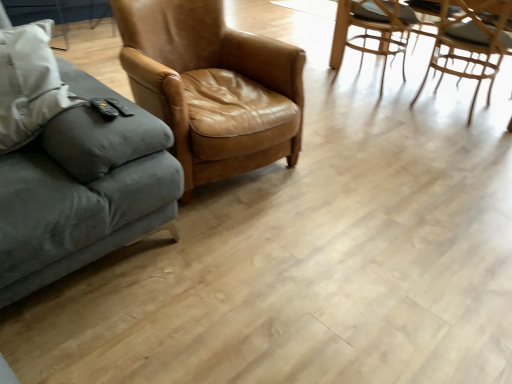
Question: From a real-world perspective, is velvet gray couch at left positioned under light brown woven chair at upper right, positioned as the 2th chair in left-to-right order, based on gravity?

Choices:
 (A) yes
 (B) no

Answer: (B)

Question: From the image's perspective, is velvet gray couch at left located above light brown woven chair at upper right, positioned as the 2th chair in left-to-right order?

Choices:
 (A) yes
 (B) no

Answer: (B)

Question: Can you confirm if velvet gray couch at left is wider than light brown woven chair at upper right, the 2th chair viewed from the right?

Choices:
 (A) no
 (B) yes

Answer: (B)

Question: Considering the relative sizes of velvet gray couch at left and light brown woven chair at upper right, positioned as the 2th chair in left-to-right order, in the image provided, is velvet gray couch at left taller than light brown woven chair at upper right, positioned as the 2th chair in left-to-right order,?

Choices:
 (A) yes
 (B) no

Answer: (A)

Question: Is velvet gray couch at left beside light brown woven chair at upper right, the 2th chair viewed from the right?

Choices:
 (A) yes
 (B) no

Answer: (B)

Question: Is point 473,54 positioned closer to the camera than point 275,122?

Choices:
 (A) farther
 (B) closer

Answer: (A)

Question: In terms of width, does light brown woven chair at upper right, which is counted as the first chair, starting from the right, look wider or thinner when compared to brown leather chair at center, the 1th chair positioned from the left?

Choices:
 (A) thin
 (B) wide

Answer: (A)

Question: From the image's perspective, is light brown woven chair at upper right, the third chair positioned from the left, located above or below brown leather chair at center, the 1th chair positioned from the left?

Choices:
 (A) above
 (B) below

Answer: (A)

Question: Considering their positions, is light brown woven chair at upper right, the third chair positioned from the left, located in front of or behind brown leather chair at center, the 3th chair in the right-to-left sequence?

Choices:
 (A) behind
 (B) front

Answer: (A)

Question: Based on their positions, is light brown woven chair at upper right, positioned as the 2th chair in left-to-right order, located to the left or right of light brown woven chair at upper right, the third chair positioned from the left?

Choices:
 (A) right
 (B) left

Answer: (B)

Question: Relative to light brown woven chair at upper right, which is counted as the first chair, starting from the right, is light brown woven chair at upper right, positioned as the 2th chair in left-to-right order, in front or behind?

Choices:
 (A) behind
 (B) front

Answer: (A)

Question: Is point (377, 19) positioned closer to the camera than point (479, 4)?

Choices:
 (A) closer
 (B) farther

Answer: (B)

Question: From a real-world perspective, is light brown woven chair at upper right, the 2th chair viewed from the right, positioned above or below light brown woven chair at upper right, which is counted as the first chair, starting from the right?

Choices:
 (A) below
 (B) above

Answer: (A)

Question: From the image's perspective, is brown leather chair at center, the 3th chair in the right-to-left sequence, above or below light brown woven chair at upper right, the 2th chair viewed from the right?

Choices:
 (A) above
 (B) below

Answer: (B)

Question: From a real-world perspective, is brown leather chair at center, the 3th chair in the right-to-left sequence, physically located above or below light brown woven chair at upper right, positioned as the 2th chair in left-to-right order?

Choices:
 (A) below
 (B) above

Answer: (B)